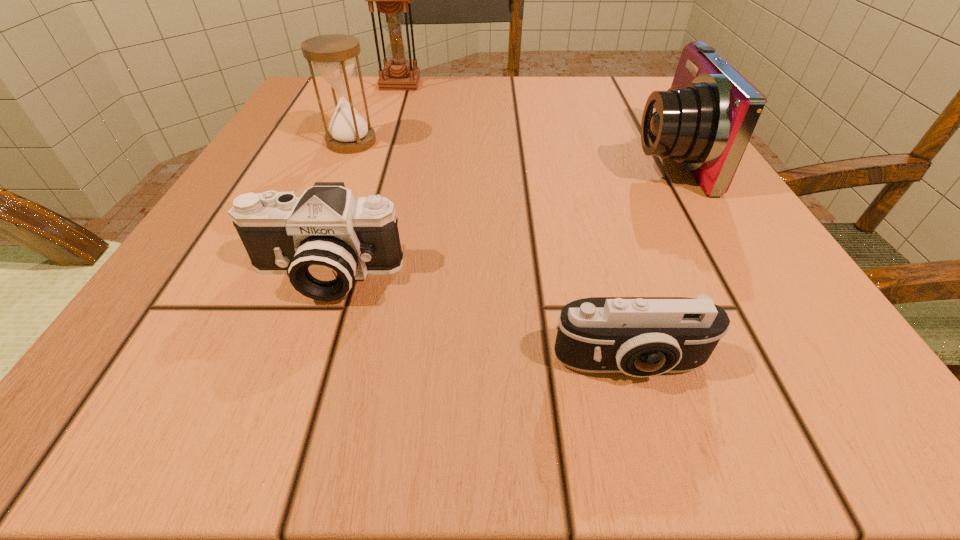
The width and height of the screenshot is (960, 540). In order to click on free spot between the farthest camera and the second camera from right to left in this screenshot , I will do `click(648, 261)`.

Identify the location of vacant region between the second camera from left to right and the second nearest object. (477, 320).

Locate an element on the screen. Image resolution: width=960 pixels, height=540 pixels. free spot between the nearest object and the farther hourglass is located at coordinates (516, 224).

Find the location of a particular element. Image resolution: width=960 pixels, height=540 pixels. vacant space in between the second farthest camera and the farther hourglass is located at coordinates (362, 179).

In order to click on free space between the rightmost object and the shortest object in this screenshot , I will do `click(648, 261)`.

Where is `unoccupied position between the nearer hourglass and the rightmost camera`? This screenshot has height=540, width=960. unoccupied position between the nearer hourglass and the rightmost camera is located at coordinates (509, 150).

The width and height of the screenshot is (960, 540). I want to click on vacant space in between the farther hourglass and the shortest camera, so click(516, 224).

The width and height of the screenshot is (960, 540). What are the coordinates of `free spot between the farther hourglass and the second object from right to left` in the screenshot? It's located at (516, 224).

Choose which object is the third nearest neighbor to the second farthest camera. Please provide its 2D coordinates. Your answer should be formatted as a tuple, i.e. [(x, y)], where the tuple contains the x and y coordinates of a point satisfying the conditions above.

[(705, 120)]

Identify which object is the third nearest to the farther hourglass. Please provide its 2D coordinates. Your answer should be formatted as a tuple, i.e. [(x, y)], where the tuple contains the x and y coordinates of a point satisfying the conditions above.

[(324, 240)]